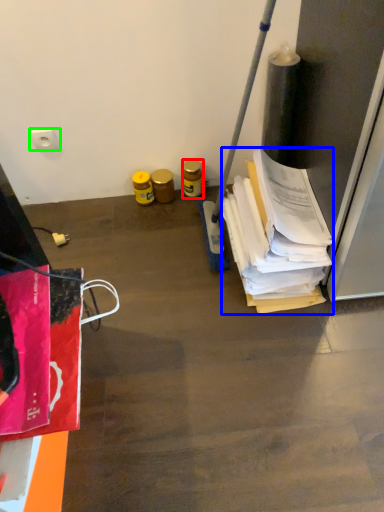
Question: Estimate the real-world distances between objects in this image. Which object is closer to bottle (highlighted by a red box), wrapping paper (highlighted by a blue box) or power plugs and sockets (highlighted by a green box)?

Choices:
 (A) wrapping paper
 (B) power plugs and sockets

Answer: (A)